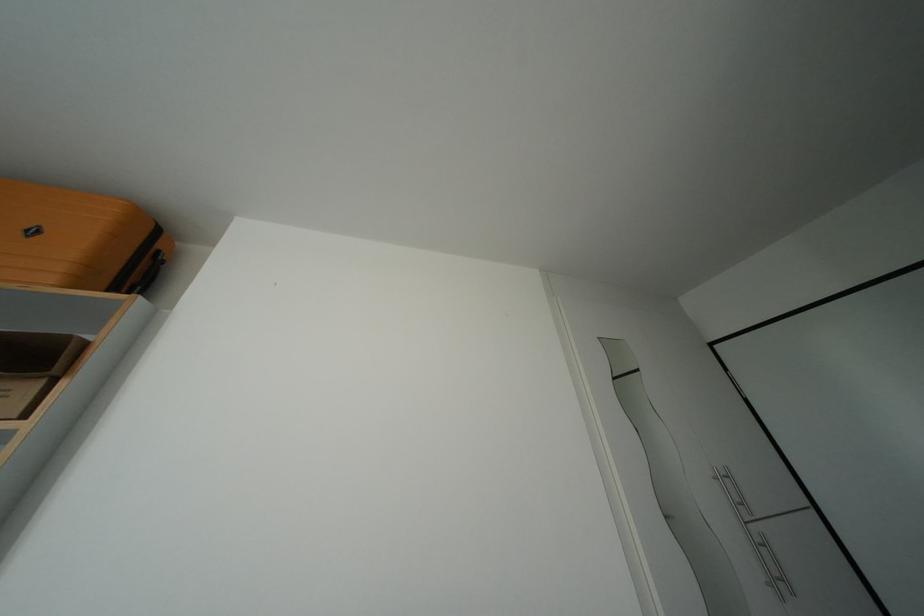
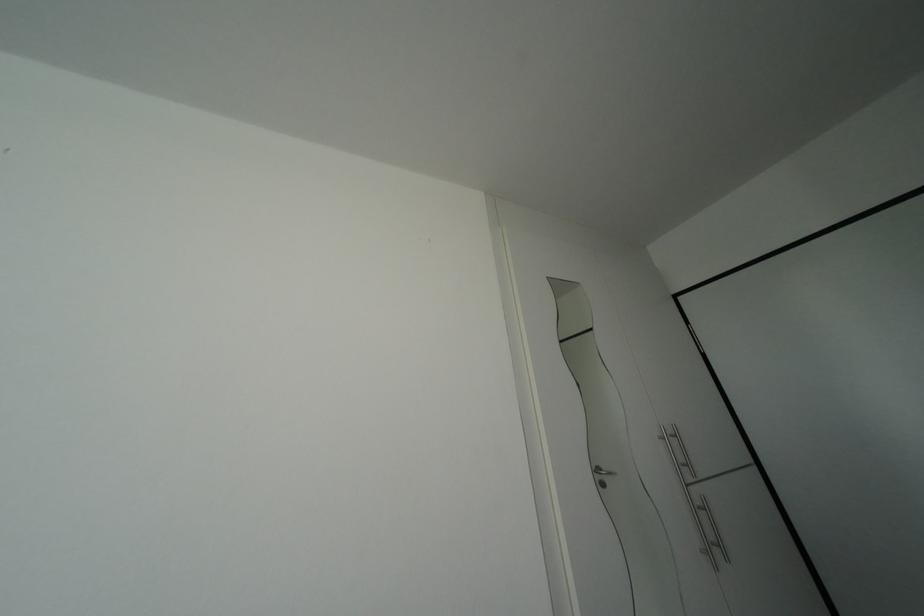
In a continuous first-person perspective shot, in which direction is the camera moving?

The cameraman moved toward right, forward.